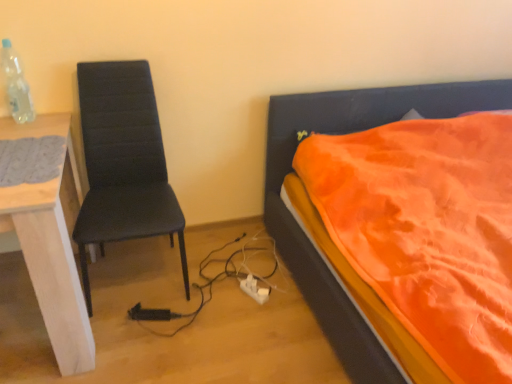
The width and height of the screenshot is (512, 384). I want to click on free spot to the right of matte black chair at left, so click(x=231, y=280).